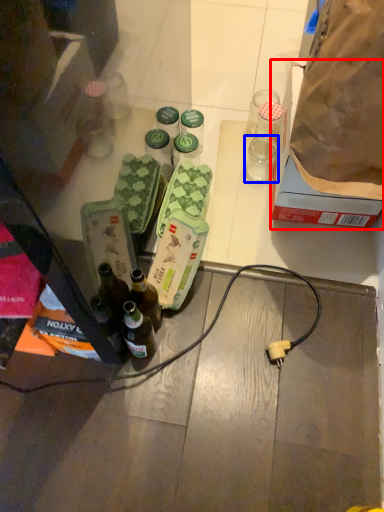
Question: Which point is further to the camera, box (highlighted by a red box) or coffee cup (highlighted by a blue box)?

Choices:
 (A) box
 (B) coffee cup

Answer: (B)